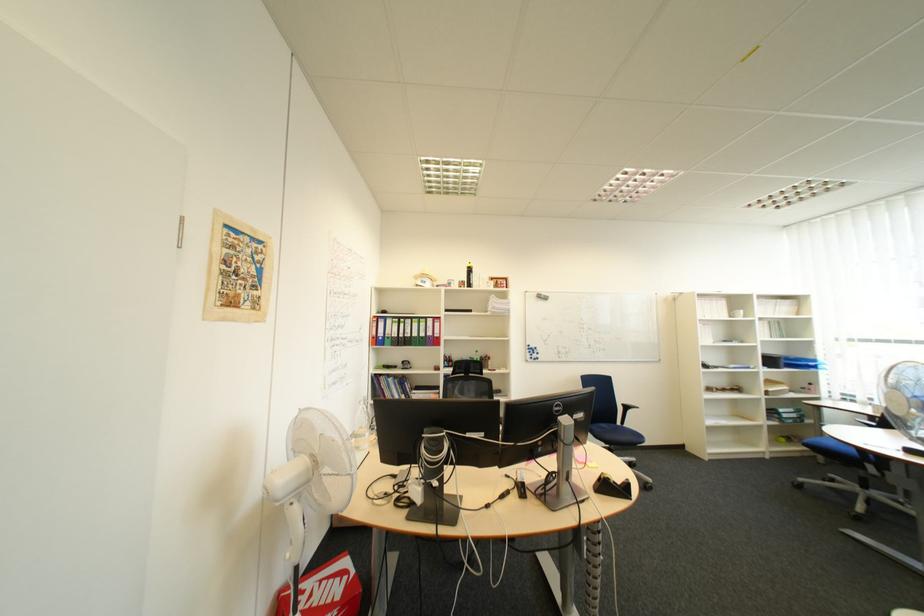
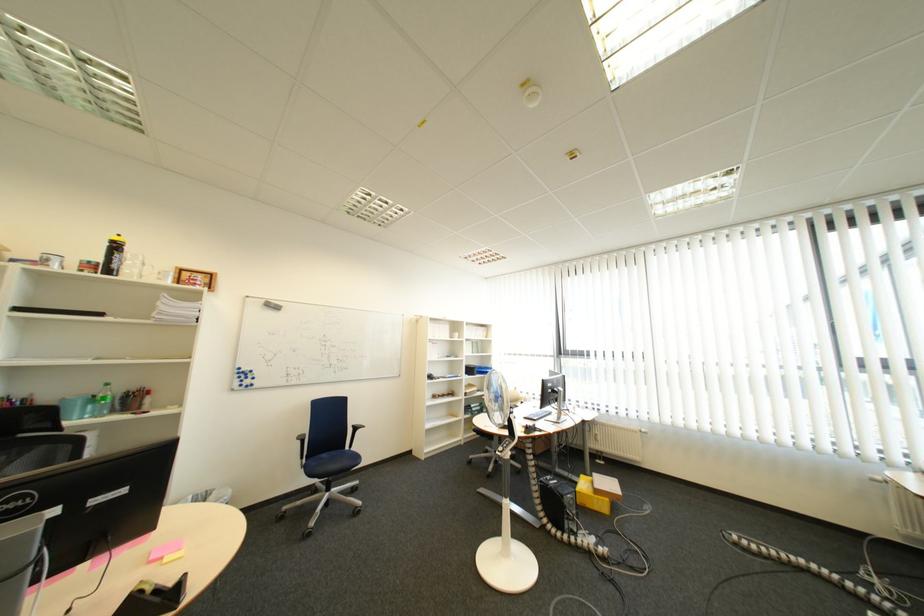
Locate, in the second image, the point that corresponds to (x=551, y=300) in the first image.

(277, 309)